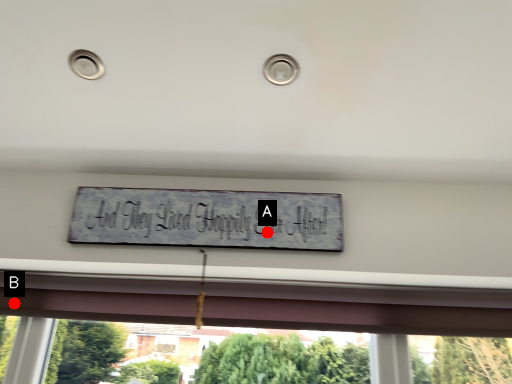
Question: Two points are circled on the image, labeled by A and B beside each circle. Which point appears closest to the camera in this image?

Choices:
 (A) A is closer
 (B) B is closer

Answer: (A)